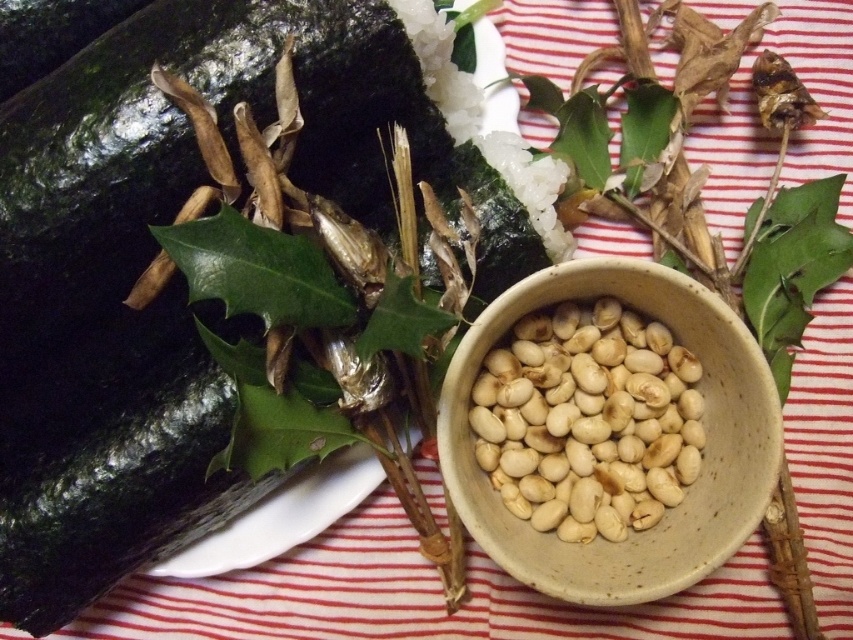
Question: Is white ceramic bowl at center to the right of white matte beans at center from the viewer's perspective?

Choices:
 (A) no
 (B) yes

Answer: (B)

Question: Does green matte cucumber at upper left lie in front of white matte beans at center?

Choices:
 (A) yes
 (B) no

Answer: (A)

Question: Which is nearer to the white ceramic bowl at center?

Choices:
 (A) white matte beans at center
 (B) green matte cucumber at upper left

Answer: (A)

Question: Which of these objects is positioned farthest from the green matte cucumber at upper left?

Choices:
 (A) white ceramic bowl at center
 (B) white matte beans at center

Answer: (A)

Question: Where is green matte cucumber at upper left located in relation to white matte beans at center in the image?

Choices:
 (A) below
 (B) above

Answer: (B)

Question: Which point is closer to the camera taking this photo?

Choices:
 (A) click(440, 454)
 (B) click(524, 339)

Answer: (A)